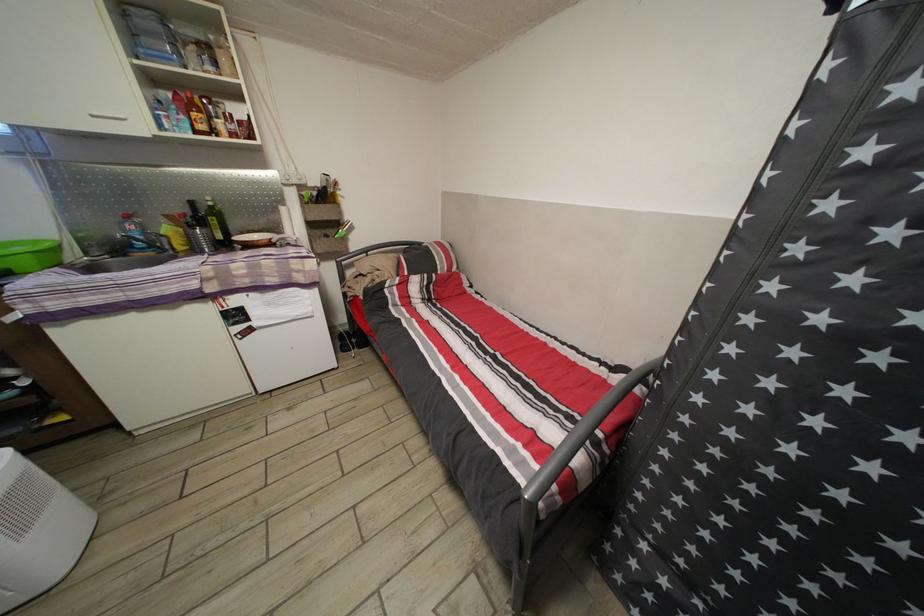
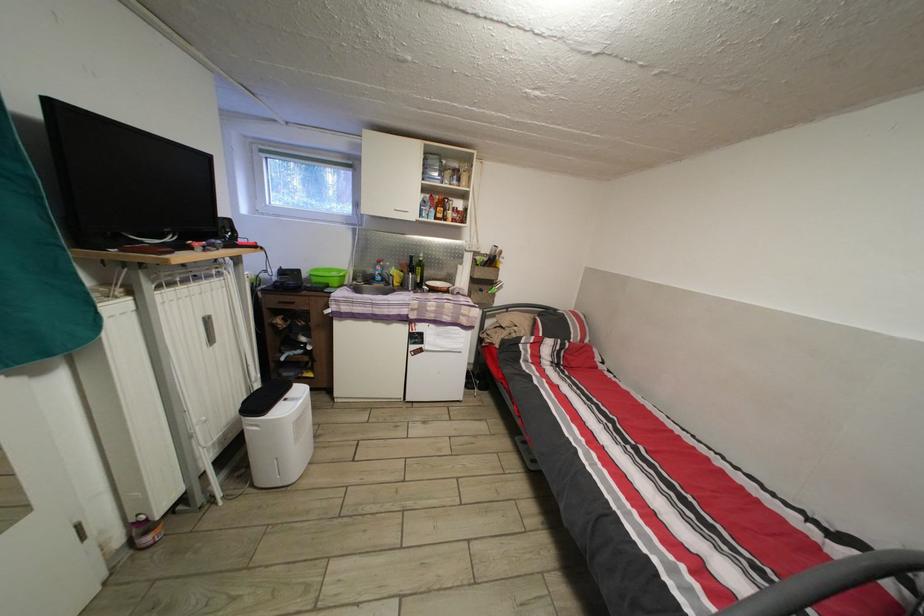
Locate, in the second image, the point that corresponds to (x=200, y=121) in the first image.

(445, 215)